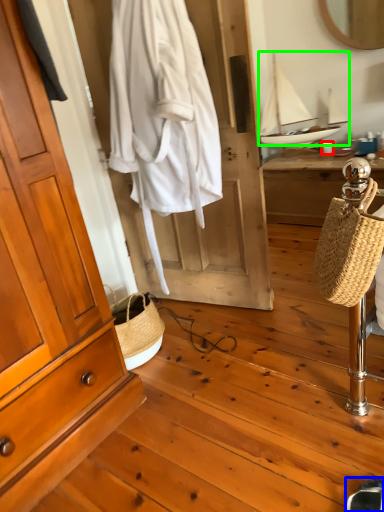
Question: Which is farther away from coffee cup (highlighted by a red box)? shoe (highlighted by a blue box) or sailboat (highlighted by a green box)?

Choices:
 (A) shoe
 (B) sailboat

Answer: (A)